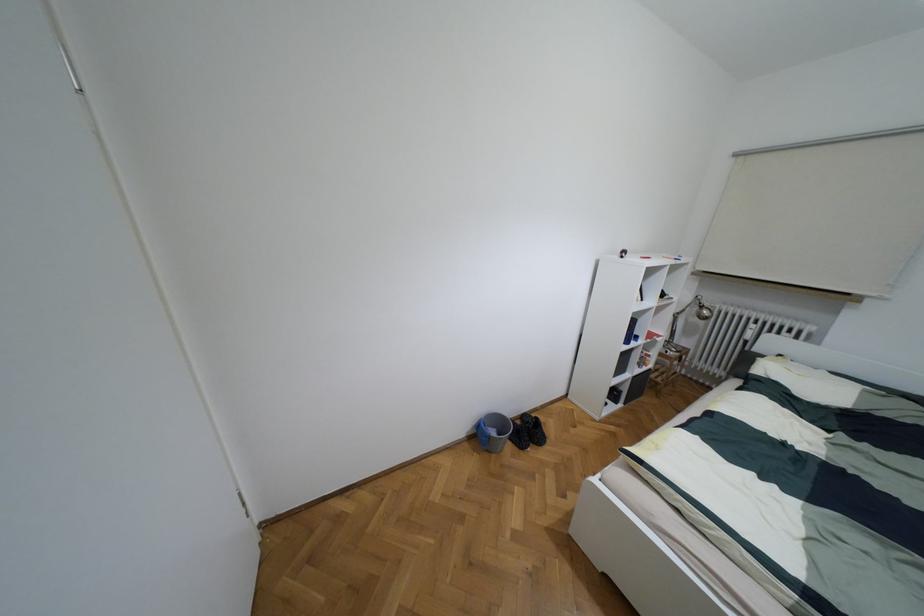
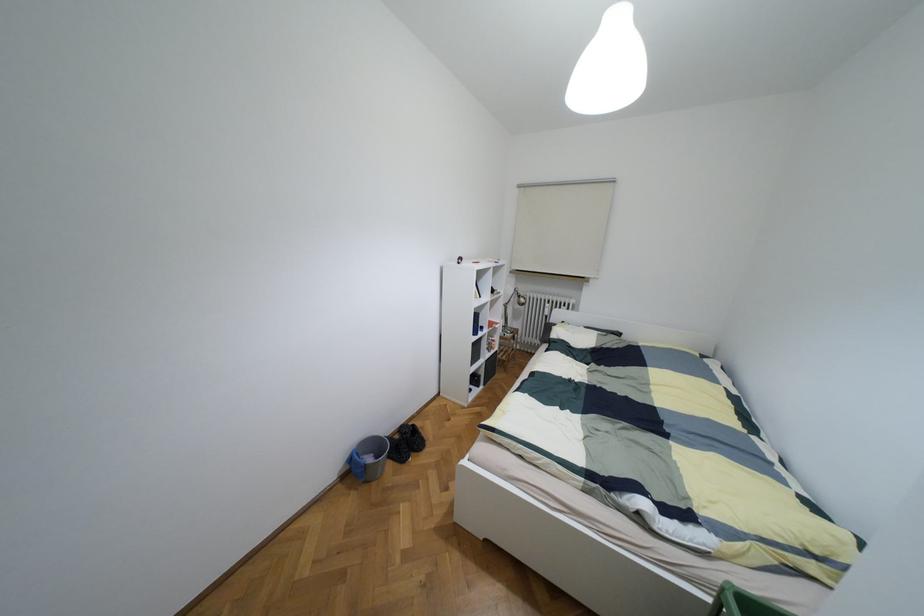
The point at (536, 418) is marked in the first image. Where is the corresponding point in the second image?

(412, 424)